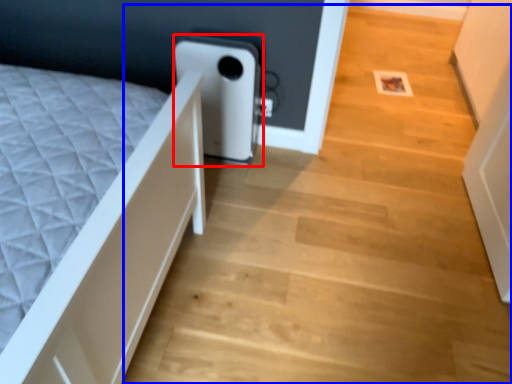
Question: Which object is closer to the camera taking this photo, water heater (highlighted by a red box) or stairwell (highlighted by a blue box)?

Choices:
 (A) water heater
 (B) stairwell

Answer: (B)